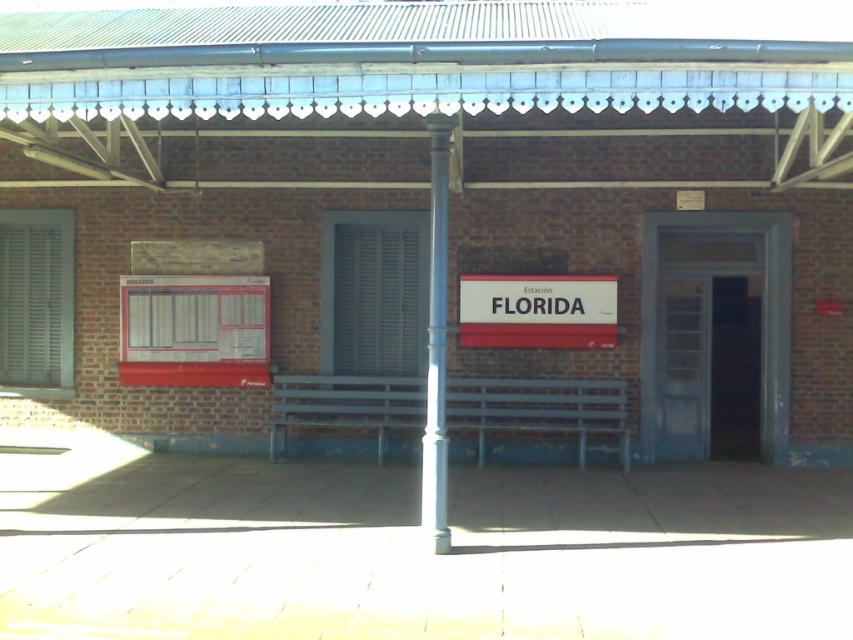
What is the position of the blue metallic bench at center relative to the white matte shutter at center?

The blue metallic bench at center is to the right of the white matte shutter at center.

What is the relationship between the height of the white matte sign at center and the metallic gray pole at center in the image?

The white matte sign at center is not as tall as the metallic gray pole at center.

You are a maintenance worker needing to replace a part between the white matte shutter at center and the metallic gray pole at center. The replacement part requires a minimum of 15 feet of space between the two objects. Can you confirm if there is enough space?

The white matte shutter at center and metallic gray pole at center are 16.01 feet apart from each other, which exceeds the required 15 feet, so there is sufficient space for the replacement part.